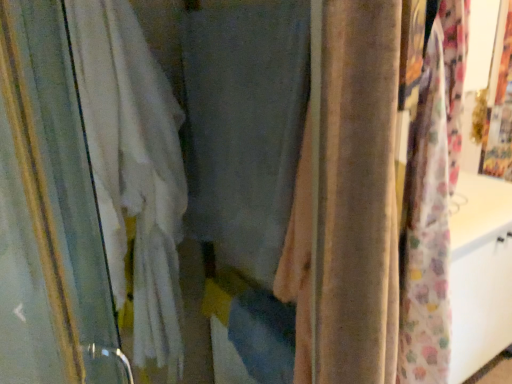
Question: Can you confirm if velvet beige curtain at center, the first curtain from the right, is bigger than white fabric curtain at left, placed as the 3th curtain when sorted from right to left?

Choices:
 (A) no
 (B) yes

Answer: (A)

Question: From a real-world perspective, is velvet beige curtain at center, the first curtain from the right, under white fabric curtain at left, placed as the 3th curtain when sorted from right to left?

Choices:
 (A) yes
 (B) no

Answer: (B)

Question: Is velvet beige curtain at center, the first curtain from the right, closer to camera compared to white fabric curtain at left, placed as the 3th curtain when sorted from right to left?

Choices:
 (A) no
 (B) yes

Answer: (B)

Question: From the image's perspective, does velvet beige curtain at center, the first curtain from the right, appear higher than white fabric curtain at left, which is the 1th curtain from left to right?

Choices:
 (A) no
 (B) yes

Answer: (B)

Question: Are velvet beige curtain at center, the first curtain from the right, and white fabric curtain at left, which is the 1th curtain from left to right, beside each other?

Choices:
 (A) yes
 (B) no

Answer: (B)

Question: Is velvet beige curtain at center, the first curtain from the right, in front of or behind matte gray curtain at center, which is the 2th curtain in left-to-right order, in the image?

Choices:
 (A) behind
 (B) front

Answer: (B)

Question: Is point (316, 51) closer or farther from the camera than point (188, 46)?

Choices:
 (A) farther
 (B) closer

Answer: (B)

Question: Looking at their shapes, would you say velvet beige curtain at center, which is the 3th curtain from left to right, is wider or thinner than matte gray curtain at center, arranged as the 2th curtain when viewed from the right?

Choices:
 (A) wide
 (B) thin

Answer: (A)

Question: From the image's perspective, relative to matte gray curtain at center, which is the 2th curtain in left-to-right order, is velvet beige curtain at center, the first curtain from the right, above or below?

Choices:
 (A) above
 (B) below

Answer: (B)

Question: Visually, is matte gray curtain at center, which is the 2th curtain in left-to-right order, positioned to the left or to the right of velvet beige curtain at center, which is the 3th curtain from left to right?

Choices:
 (A) left
 (B) right

Answer: (A)

Question: From the image's perspective, is matte gray curtain at center, which is the 2th curtain in left-to-right order, located above or below velvet beige curtain at center, which is the 3th curtain from left to right?

Choices:
 (A) above
 (B) below

Answer: (A)

Question: Based on their sizes in the image, would you say matte gray curtain at center, which is the 2th curtain in left-to-right order, is bigger or smaller than velvet beige curtain at center, which is the 3th curtain from left to right?

Choices:
 (A) small
 (B) big

Answer: (B)

Question: From a real-world perspective, is matte gray curtain at center, arranged as the 2th curtain when viewed from the right, above or below velvet beige curtain at center, the first curtain from the right?

Choices:
 (A) below
 (B) above

Answer: (B)

Question: Is white fabric curtain at left, placed as the 3th curtain when sorted from right to left, to the left or to the right of matte gray curtain at center, arranged as the 2th curtain when viewed from the right, in the image?

Choices:
 (A) right
 (B) left

Answer: (B)

Question: Is point (101, 240) positioned closer to the camera than point (216, 34)?

Choices:
 (A) farther
 (B) closer

Answer: (A)